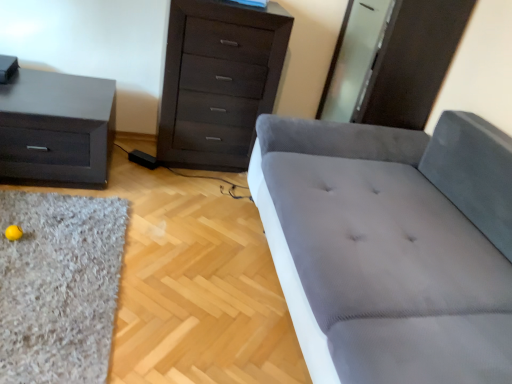
Locate an element on the screen. This screenshot has height=384, width=512. vacant space to the right of matte black nightstand at left is located at coordinates (161, 198).